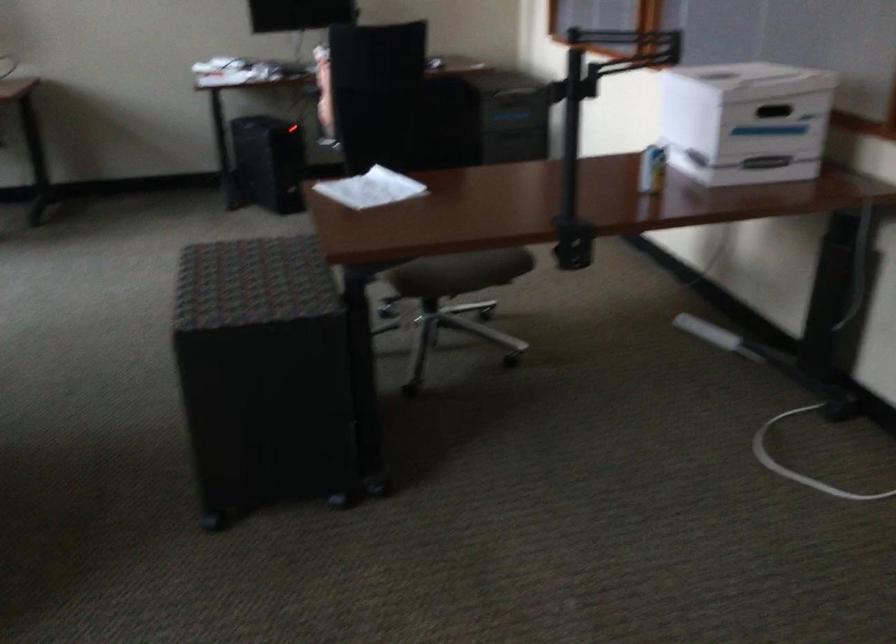
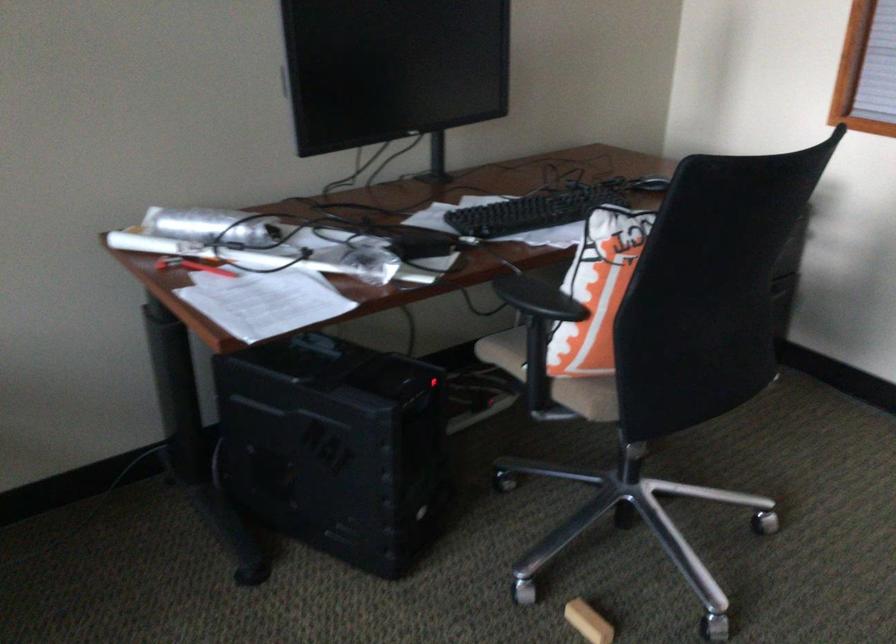
The point at (328, 78) is marked in the first image. Where is the corresponding point in the second image?

(538, 299)